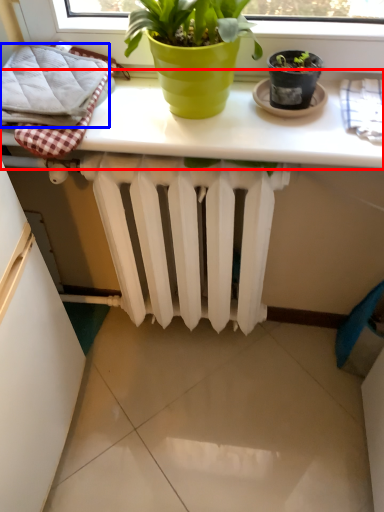
Question: Which object is further to the camera taking this photo, table (highlighted by a red box) or bath towel (highlighted by a blue box)?

Choices:
 (A) table
 (B) bath towel

Answer: (B)